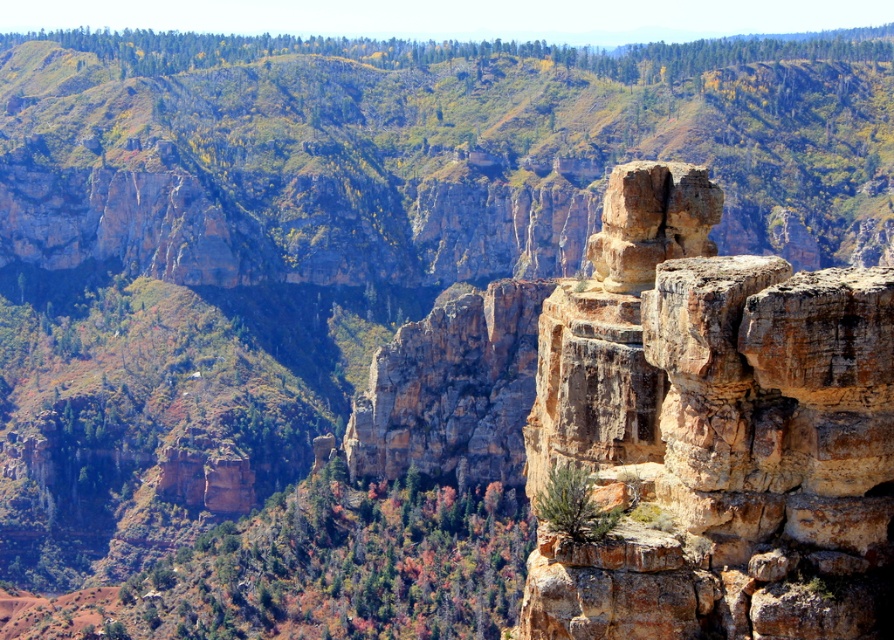
Question: Among these objects, which one is farthest from the camera?

Choices:
 (A) rusty brown rock at right
 (B) rustic stone cliff at center

Answer: (B)

Question: In this image, where is rustic stone cliff at center located relative to rusty brown rock at right?

Choices:
 (A) above
 (B) below

Answer: (A)

Question: Is rustic stone cliff at center bigger than rusty brown rock at right?

Choices:
 (A) yes
 (B) no

Answer: (A)

Question: From the image, what is the correct spatial relationship of rustic stone cliff at center in relation to rusty brown rock at right?

Choices:
 (A) below
 (B) above

Answer: (B)

Question: Among these points, which one is nearest to the camera?

Choices:
 (A) (824, 573)
 (B) (618, 118)

Answer: (A)